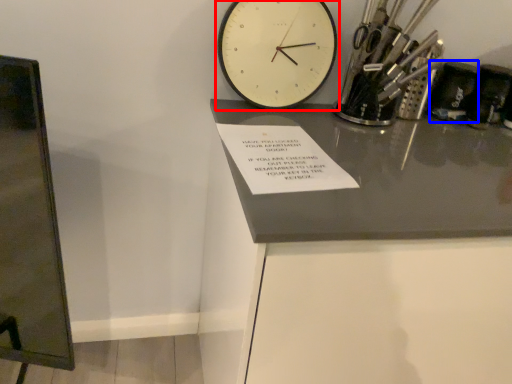
Question: Among these objects, which one is nearest to the camera, wall clock (highlighted by a red box) or stationery (highlighted by a blue box)?

Choices:
 (A) wall clock
 (B) stationery

Answer: (A)